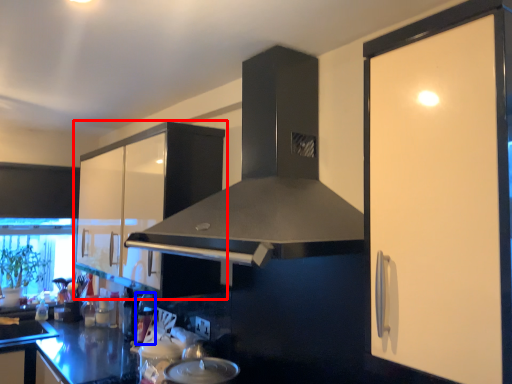
Question: Among these objects, which one is nearest to the camera, cabinetry (highlighted by a red box) or appliance (highlighted by a blue box)?

Choices:
 (A) cabinetry
 (B) appliance

Answer: (A)